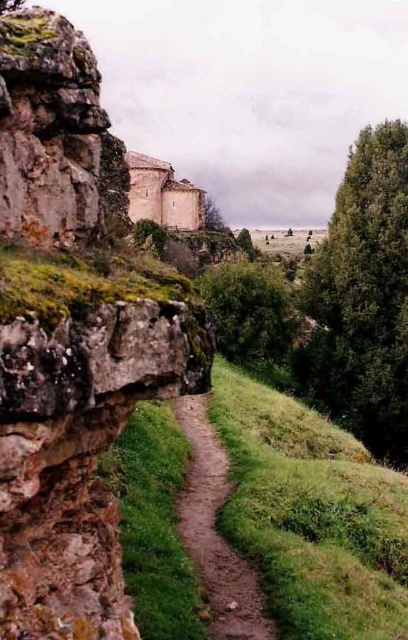
Is point (310, 458) closer to viewer compared to point (248, 280)?

That is True.

Can you confirm if green grassy at center is positioned above green leafy tree at center?

No.

Between point (328, 531) and point (288, 292), which one is positioned behind?

Positioned behind is point (288, 292).

This screenshot has width=408, height=640. I want to click on green grassy at center, so click(312, 515).

Between point (226, 554) and point (235, 321), which one is positioned behind?

The point (235, 321) is more distant.

Does brown dirt path at center appear on the left side of green leafy tree at center?

Indeed, brown dirt path at center is positioned on the left side of green leafy tree at center.

Which is behind, point (248, 564) or point (237, 308)?

The point (237, 308) is behind.

Where is `brown dirt path at center`? Image resolution: width=408 pixels, height=640 pixels. brown dirt path at center is located at coordinates (215, 532).

Who is higher up, green grassy at center or brown dirt path at center?

brown dirt path at center

What do you see at coordinates (312, 515) in the screenshot? The width and height of the screenshot is (408, 640). I see `green grassy at center` at bounding box center [312, 515].

Locate an element on the screen. Image resolution: width=408 pixels, height=640 pixels. green grassy at center is located at coordinates (312, 515).

Identify the location of green grassy at center. This screenshot has width=408, height=640. (312, 515).